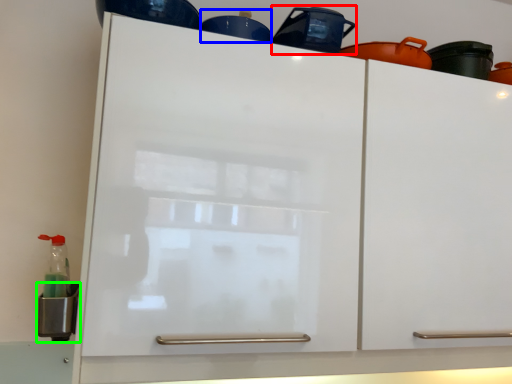
Question: Estimate the real-world distances between objects in this image. Which object is closer to appliance (highlighted by a red box), appliance (highlighted by a blue box) or appliance (highlighted by a green box)?

Choices:
 (A) appliance
 (B) appliance

Answer: (A)